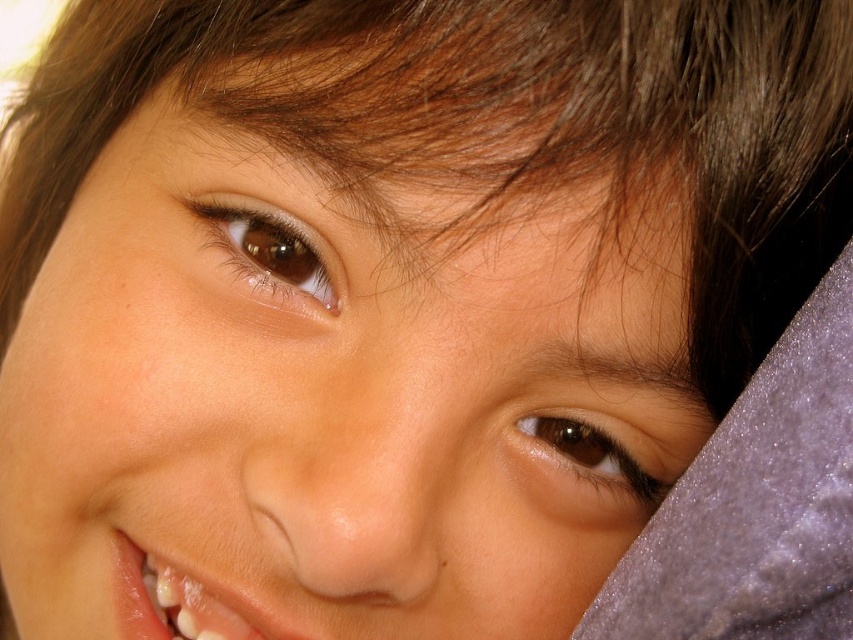
You are an artist trying to sketch the child in the image. You want to place the brown shiny eye at upper center accurately. According to the coordinates provided, where should you position it on your paper?

The brown shiny eye at upper center should be positioned at coordinates point (270, 248).